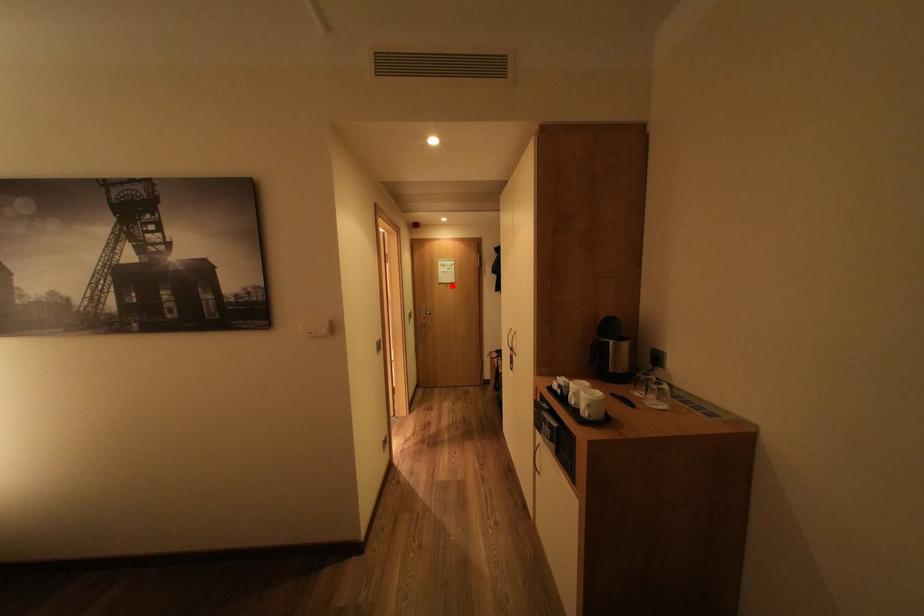
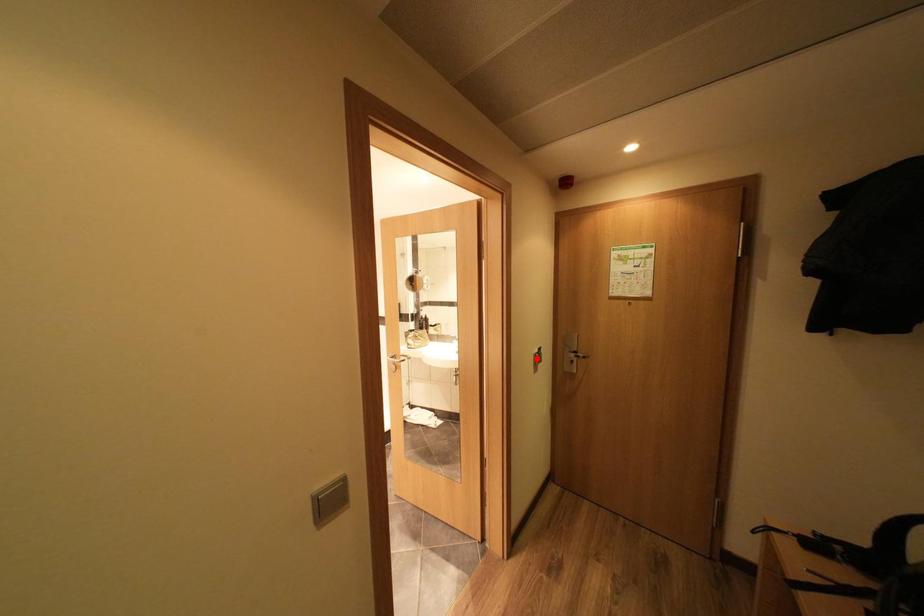
I am providing you with two images of the same scene from different viewpoints. A red point is marked on the first image and another point is marked on the second image. Is the marked point in image1 the same physical position as the marked point in image2?

No